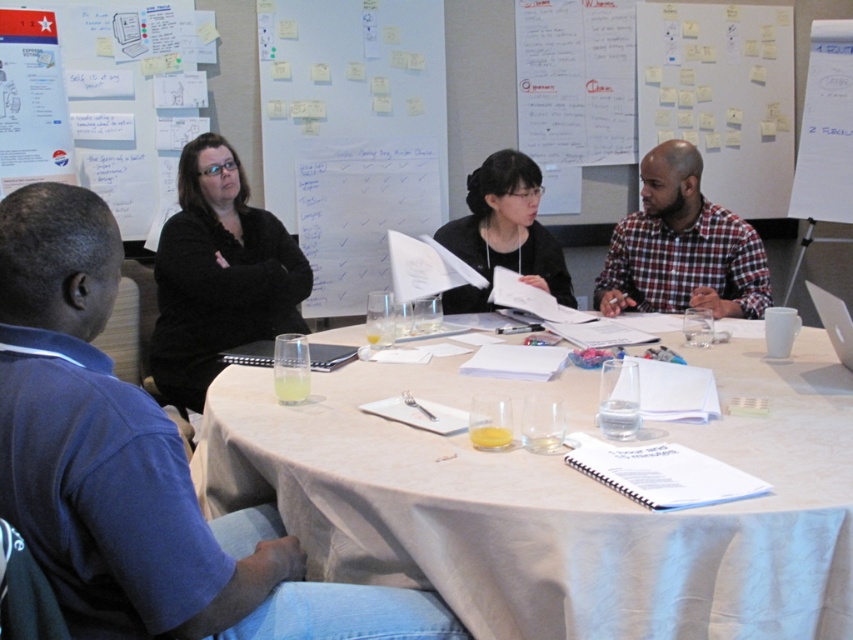
Question: From the image, what is the correct spatial relationship of white textured table at center in relation to black matte/black paper at center?

Choices:
 (A) below
 (B) above

Answer: (A)

Question: Does white textured table at center have a smaller size compared to plaid shirt at center?

Choices:
 (A) yes
 (B) no

Answer: (B)

Question: Considering the real-world distances, which object is closest to the black matte/black paper at center?

Choices:
 (A) plaid shirt at center
 (B) black matte shirt at upper left
 (C) blue shirt at left
 (D) white textured table at center

Answer: (A)

Question: Which point appears farthest from the camera in this image?

Choices:
 (A) (160, 262)
 (B) (515, 225)
 (C) (650, 163)
 (D) (337, 394)

Answer: (B)

Question: Is white textured table at center positioned at the back of black matte/black paper at center?

Choices:
 (A) yes
 (B) no

Answer: (B)

Question: Among these points, which one is nearest to the camera?

Choices:
 (A) (653, 211)
 (B) (241, 200)

Answer: (A)